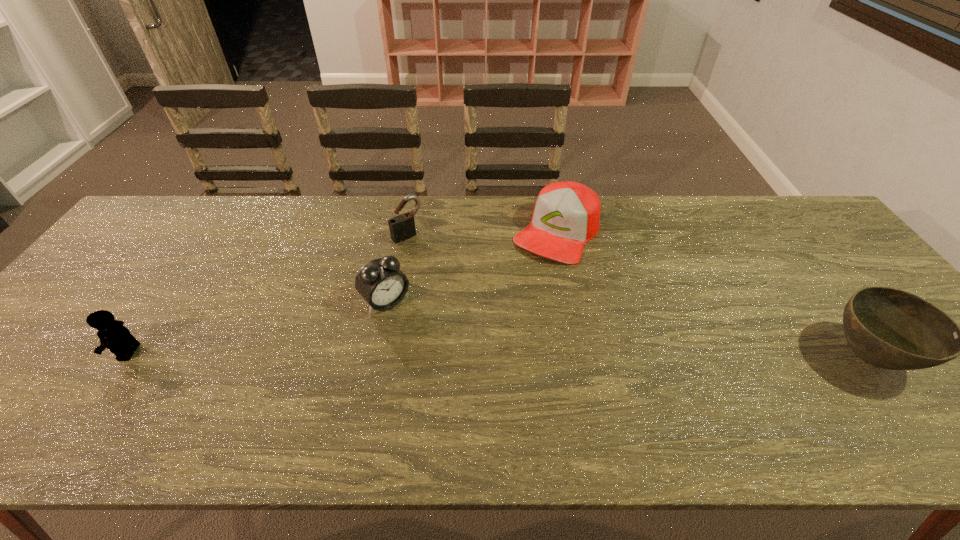
This screenshot has width=960, height=540. I want to click on Lego, so click(x=113, y=335).

At what (x,y) coordinates should I click in order to perform the action: click on bowl. Please return your answer as a coordinate pair (x, y). This screenshot has width=960, height=540. Looking at the image, I should click on (889, 328).

In order to click on padlock in this screenshot , I will do `click(402, 227)`.

Find the location of a particular element. The height and width of the screenshot is (540, 960). baseball cap is located at coordinates (567, 214).

Locate an element on the screen. This screenshot has height=540, width=960. alarm clock is located at coordinates (382, 284).

You are a GUI agent. You are given a task and a screenshot of the screen. Output one action in this format:
    pyautogui.click(x=<x>, y=<y>)
    Task: Click on the vacant space situated 0.200m on the front-facing side of the Lego
    The height and width of the screenshot is (540, 960).
    Given the screenshot: What is the action you would take?
    tap(33, 352)

This screenshot has height=540, width=960. I want to click on vacant area located on the left of the bowl, so click(696, 357).

The image size is (960, 540). Find the location of `vacant area situated with the keyhole on the front of the padlock`. vacant area situated with the keyhole on the front of the padlock is located at coordinates (438, 267).

Locate an element on the screen. The height and width of the screenshot is (540, 960). free point located with the keyhole on the front of the padlock is located at coordinates (427, 255).

This screenshot has height=540, width=960. Identify the location of vacant region located 0.270m with the keyhole on the front of the padlock. (466, 296).